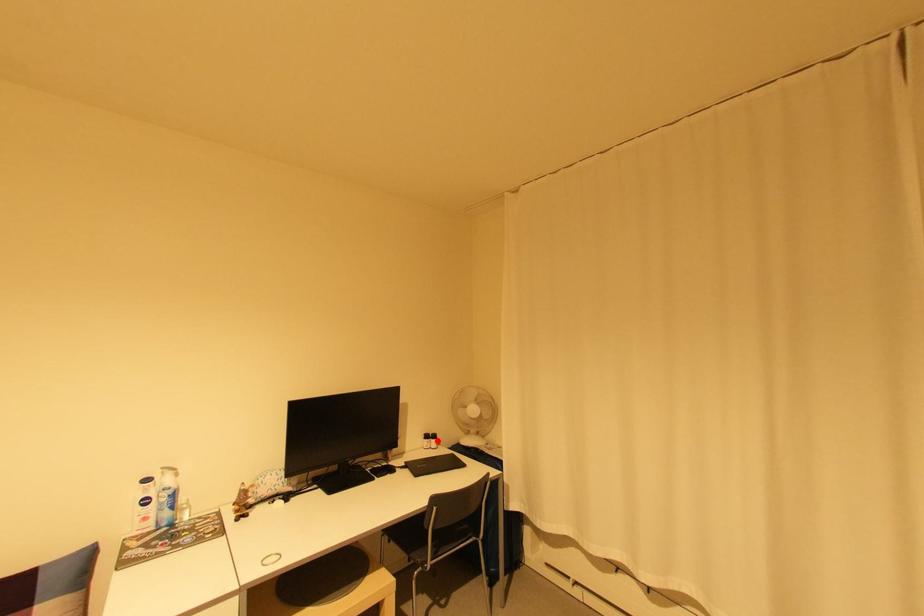
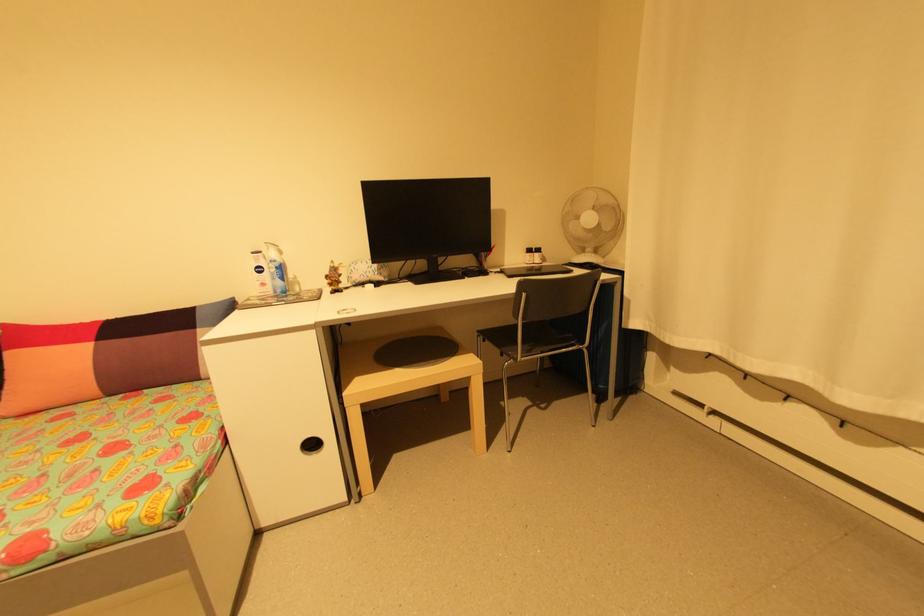
Question: I am providing you with two images of the same scene from different viewpoints. Image1 has a red point marked. In image2, the corresponding 3D location appears at what relative position? Reply with the corresponding letter.

Choices:
 (A) Closer
 (B) Farther

Answer: (A)